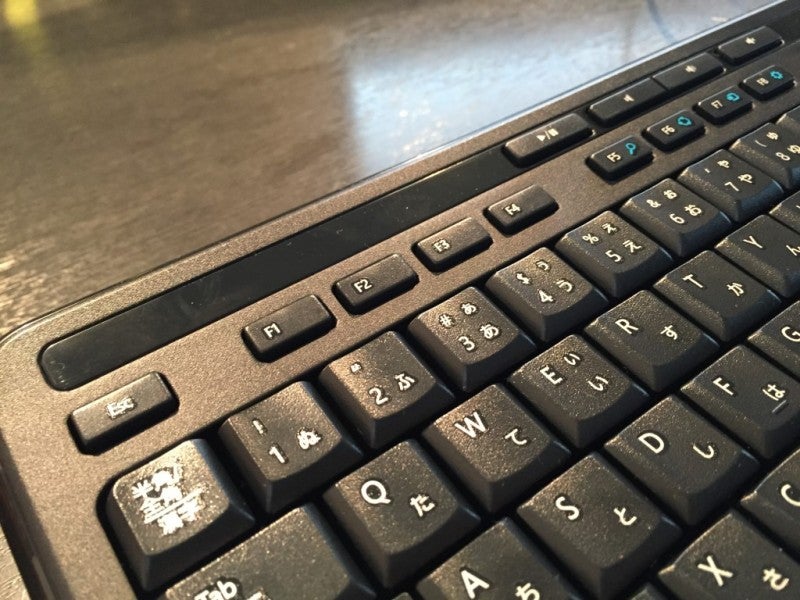
Identify the location of desk. The width and height of the screenshot is (800, 600). (210, 135).